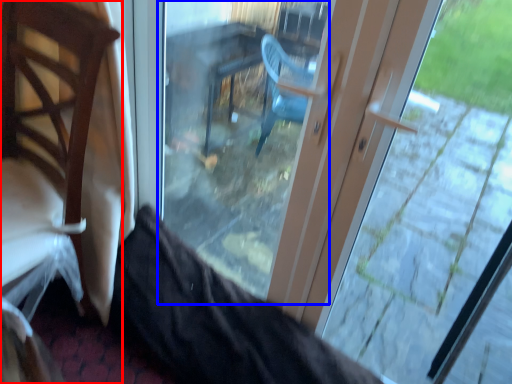
Question: Which point is closer to the camera, chair (highlighted by a red box) or glass door (highlighted by a blue box)?

Choices:
 (A) chair
 (B) glass door

Answer: (A)